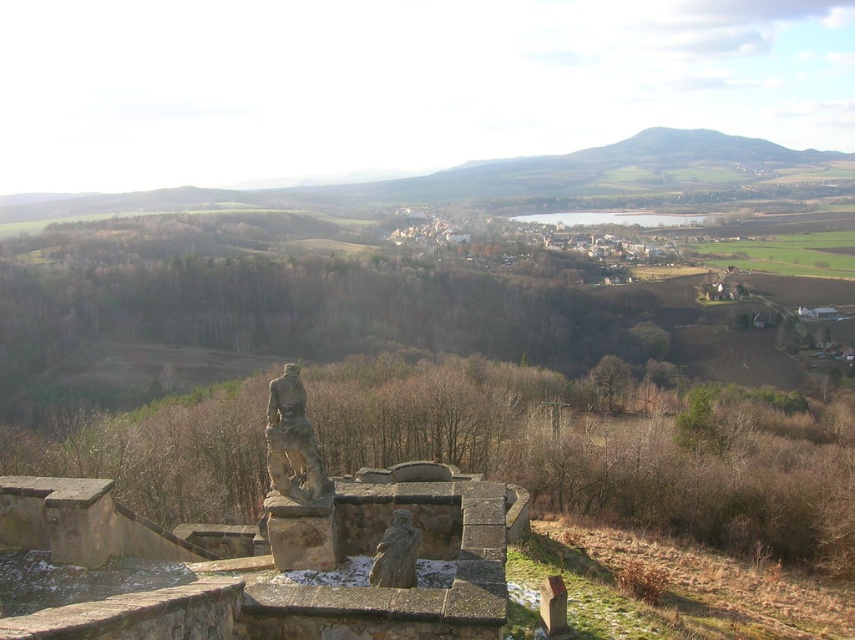
Can you confirm if stone statue at center is positioned below rustic stone statue at center?

No, stone statue at center is not below rustic stone statue at center.

Which is behind, point (287, 490) or point (370, 586)?

The point (287, 490) is behind.

Does point (293, 397) come behind point (407, 573)?

Yes, it is behind point (407, 573).

Locate an element on the screen. stone statue at center is located at coordinates (292, 442).